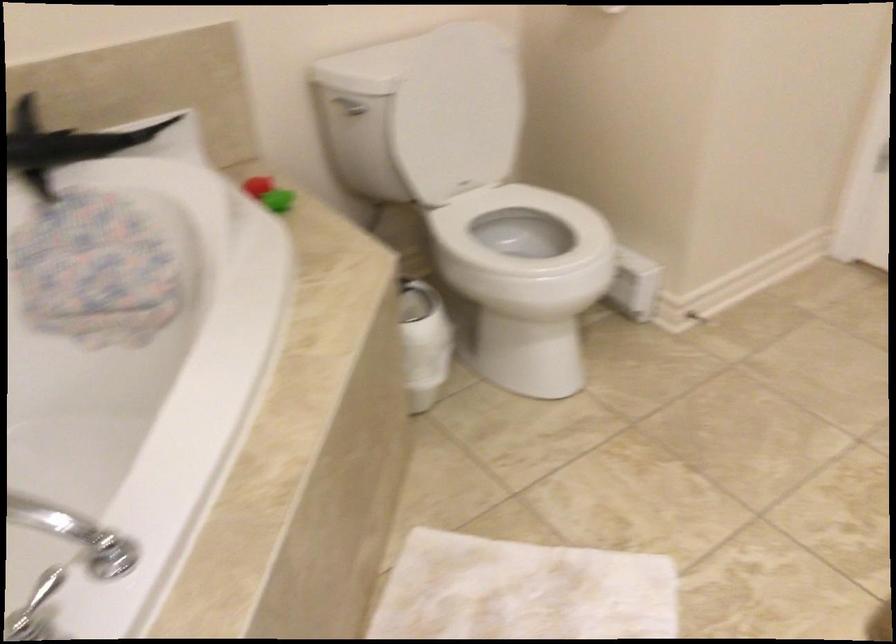
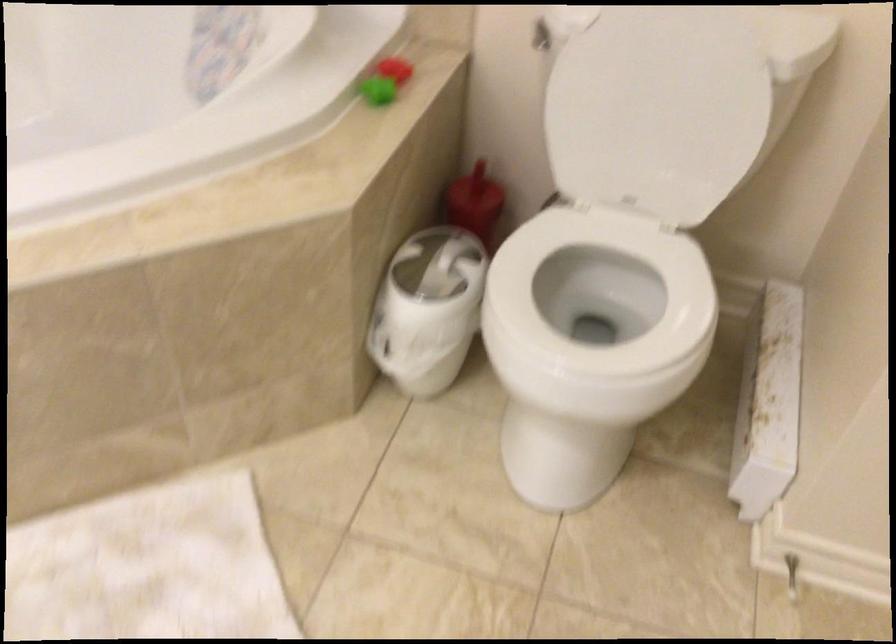
Find the pixel in the second image that matches [452,109] in the first image.

(657, 109)